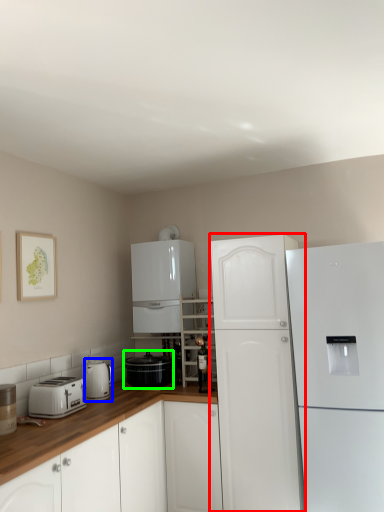
Question: Considering the real-world distances, which object is closest to refrigerator (highlighted by a red box)? kitchen appliance (highlighted by a blue box) or kitchen appliance (highlighted by a green box).

Choices:
 (A) kitchen appliance
 (B) kitchen appliance

Answer: (B)